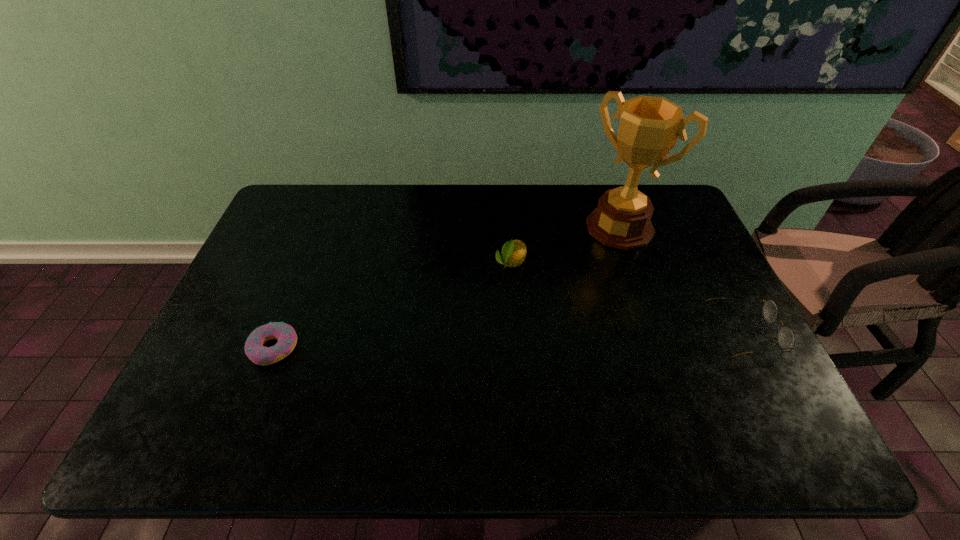
You are a GUI agent. You are given a task and a screenshot of the screen. Output one action in this format:
    pyautogui.click(x=<x>, y=<y>)
    Task: Click on the vacant area situated 0.160m on the front-facing side of the second object from right to left
    
    Given the screenshot: What is the action you would take?
    pyautogui.click(x=577, y=275)

The width and height of the screenshot is (960, 540). I want to click on free space located on the front-facing side of the second object from right to left, so click(564, 291).

Find the location of a particular element. The width and height of the screenshot is (960, 540). free space located with leaves positioned above the third shortest object is located at coordinates (483, 308).

Where is `free region located with leaves positioned above the third shortest object`? This screenshot has height=540, width=960. free region located with leaves positioned above the third shortest object is located at coordinates (449, 358).

This screenshot has width=960, height=540. Identify the location of vacant space located 0.090m with leaves positioned above the third shortest object. (491, 295).

Where is `object present at the far edge`? object present at the far edge is located at coordinates (649, 127).

This screenshot has width=960, height=540. Find the location of `object that is at the left edge`. object that is at the left edge is located at coordinates (285, 334).

The height and width of the screenshot is (540, 960). I want to click on spectacles at the right edge, so click(785, 336).

At what (x,y) coordinates should I click in order to perform the action: click on award at the right edge. Please return your answer as a coordinate pair (x, y). Image resolution: width=960 pixels, height=540 pixels. Looking at the image, I should click on (649, 127).

Locate an element on the screen. object at the far right corner is located at coordinates (649, 127).